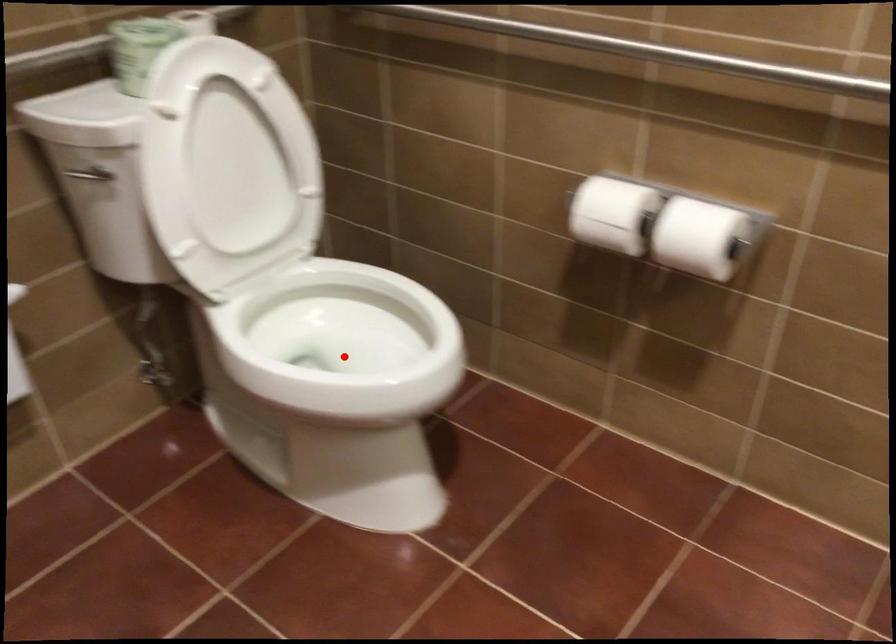
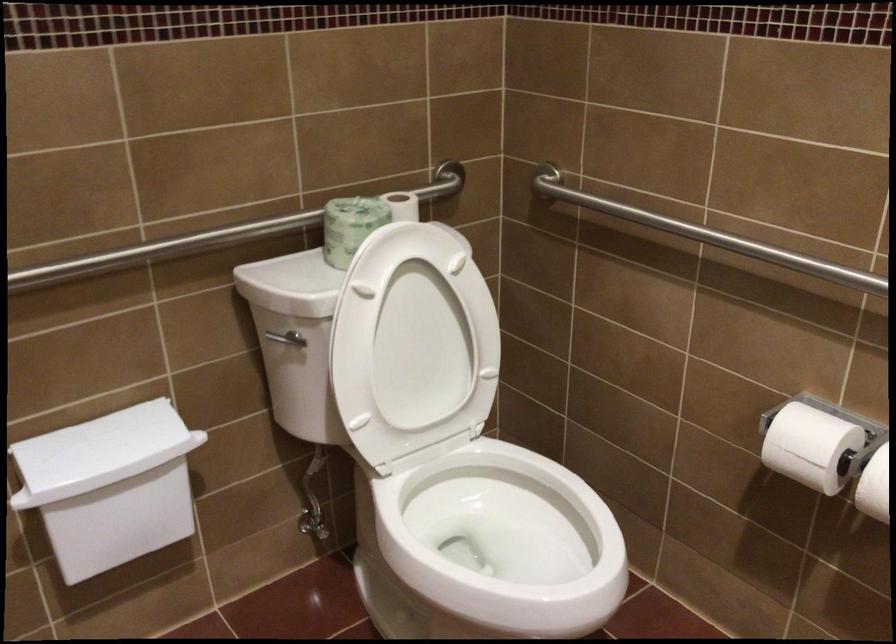
Where in the second image is the point corresponding to the highlighted location from the first image?

(497, 544)